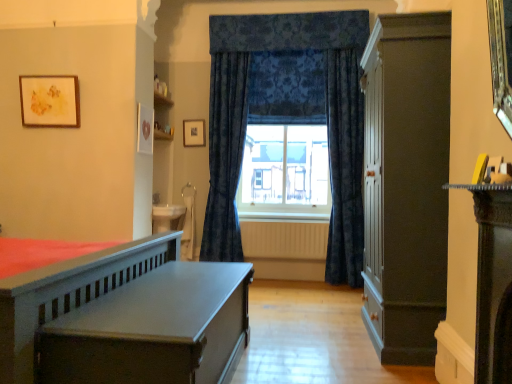
Question: Would you say dark blue velvet curtains at center, acting as the first curtain starting from the left, is to the left or to the right of wooden picture frame at upper left, which ranks as the 2th picture frame in right-to-left order, in the picture?

Choices:
 (A) left
 (B) right

Answer: (B)

Question: Considering the positions of dark blue velvet curtains at center, acting as the first curtain starting from the left, and wooden picture frame at upper left, the 1th picture frame in the left-to-right sequence, in the image, is dark blue velvet curtains at center, acting as the first curtain starting from the left, wider or thinner than wooden picture frame at upper left, the 1th picture frame in the left-to-right sequence,?

Choices:
 (A) thin
 (B) wide

Answer: (B)

Question: Which object is positioned closest to the matte black picture frame at upper center, the 2th picture frame when ordered from front to back?

Choices:
 (A) wooden picture frame at upper left, which is counted as the first picture frame, starting from the front
 (B) white textured radiator at center
 (C) dark blue velvet curtains at center, acting as the first curtain starting from the left
 (D) matte gray wooden bed at left
 (E) velvet dark blue curtain at center, which is the 2th curtain in left-to-right order

Answer: (C)

Question: Based on their relative distances, which object is nearer to the white textured radiator at center?

Choices:
 (A) matte black picture frame at upper center, which ranks as the first picture frame in right-to-left order
 (B) dark blue velvet curtains at center, the second curtain viewed from the right
 (C) matte dark brown cabinet at right
 (D) velvet dark blue curtain at center, which is counted as the 1th curtain, starting from the right
 (E) wooden picture frame at upper left, the 1th picture frame in the left-to-right sequence

Answer: (D)